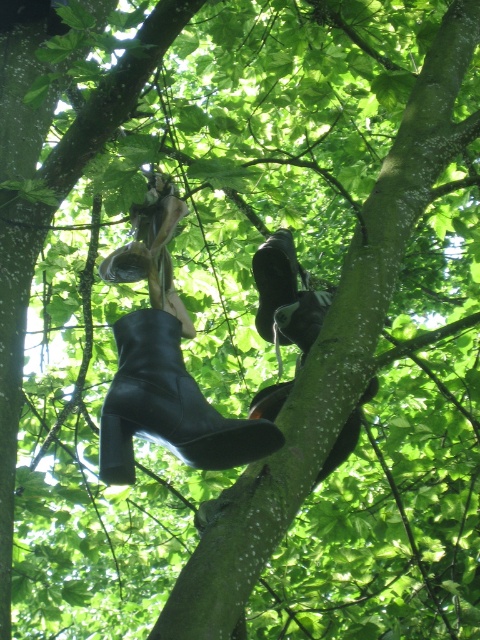
You are a delivery person trying to retrieve a package from the tree. The package is hanging from the branches between the black leather boot at center and the black leather boot at upper center. Which boot is closer to the ground, allowing easier access to the package?

The black leather boot at center is taller than the black leather boot at upper center, so the package between them is closer to the ground near the black leather boot at center, making it easier to access.

You are standing in a park and see the black leather boot at center hanging from a tree branch. If you want to touch the boot with your hand, can you reach it without jumping? Assume your hand can reach up to 1.6 meters from the ground.

The black leather boot at center is 1.19 meters away from the viewer. Since your hand can reach up to 1.6 meters, you can reach it without jumping.